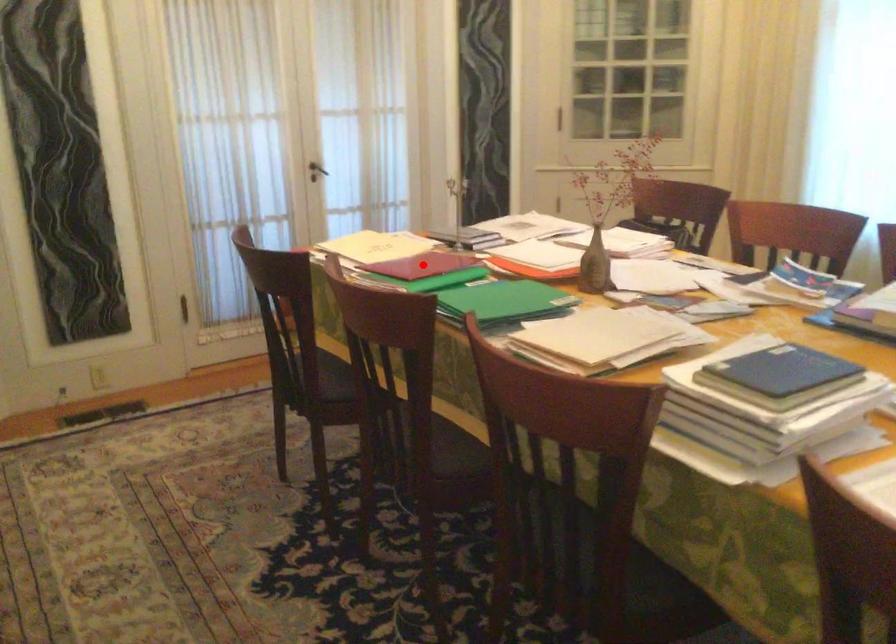
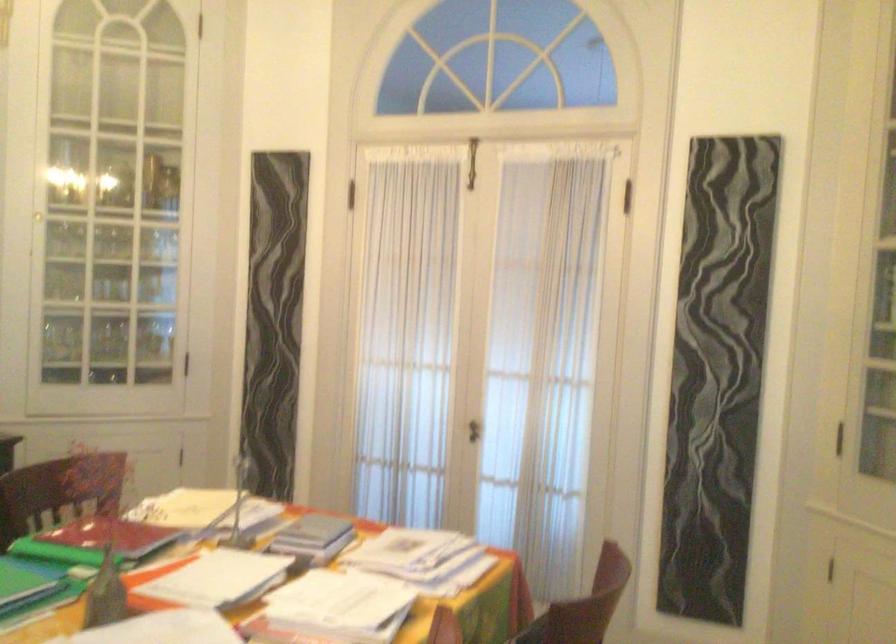
Question: I am providing you with two images of the same scene from different viewpoints. A red point is marked on the first image. At the location where the point appears in image 1, is it still visible in image 2?

Choices:
 (A) Yes
 (B) No

Answer: (B)